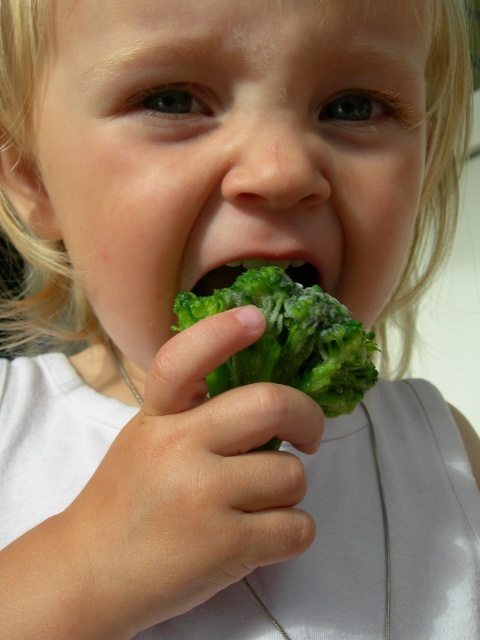
In the scene shown: You are a photographer trying to capture the broccoli in focus. You notice two instances of broccoli in the scene. Which one is closer to you, the photographer, the green matte broccoli at center or the green matte broccoli at mouth?

The green matte broccoli at center is closer to the viewer than the green matte broccoli at mouth.

You are a nutritionist trying to measure the distance between the broccoli pieces in the image. Given that the recommended minimum distance between two food items for proper eating is 4 centimeters, can you confirm if the green matte broccoli at center and the green matte broccoli at mouth meet this requirement?

The green matte broccoli at center and the green matte broccoli at mouth are 5.04 centimeters apart from each other, which exceeds the recommended minimum distance of 4 centimeters. Therefore, they meet the requirement.

You are a nutritionist analyzing the image of a child eating broccoli. You notice two broccoli parts labeled as green matte broccoli at center and green matte broccoli at mouth. Which broccoli part is wider?

The green matte broccoli at center might be wider than green matte broccoli at mouth.